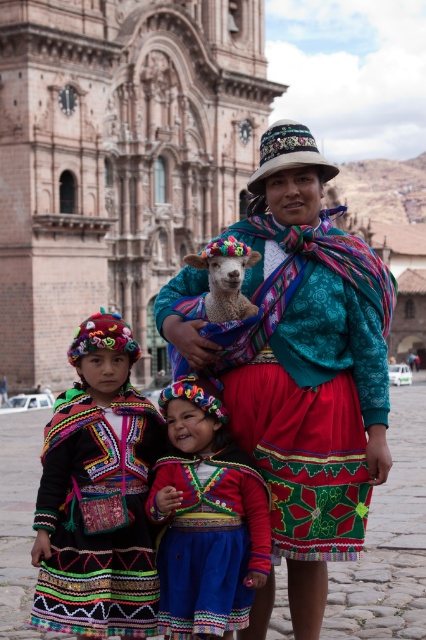
Is point (137, 433) more distant than point (196, 579)?

Yes, it is behind point (196, 579).

Which is in front, point (71, 435) or point (167, 513)?

Point (167, 513) is in front.

Does point (140, 564) come behind point (167, 422)?

No, it is not.

Where is `multicolored embroidered jacket at center`? The width and height of the screenshot is (426, 640). multicolored embroidered jacket at center is located at coordinates (97, 493).

What do you see at coordinates (206, 518) in the screenshot?
I see `multicolored woven fabric at center` at bounding box center [206, 518].

Find the location of a particular element. multicolored woven fabric at center is located at coordinates (206, 518).

Can you confirm if textured woolen shawl at center is positioned to the right of multicolored woven fabric at center?

Yes, textured woolen shawl at center is to the right of multicolored woven fabric at center.

Is point (224, 381) positioned before point (166, 419)?

No.

Does point (302, 177) lie in front of point (256, 536)?

No, it is behind (256, 536).

Where is `textured woolen shawl at center`? textured woolen shawl at center is located at coordinates (299, 364).